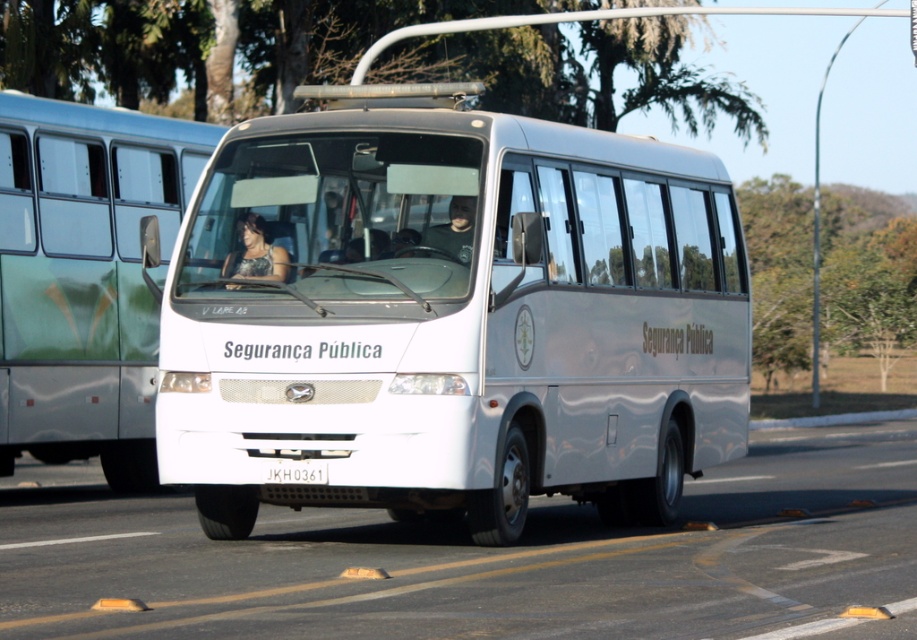
Question: Which object is positioned closest to the white metallic bus at center?

Choices:
 (A) white glossy bus at center
 (B) sparkly silver dress at center
 (C) matte black jacket at center

Answer: (C)

Question: Is white metallic bus at center thinner than white glossy bus at center?

Choices:
 (A) no
 (B) yes

Answer: (B)

Question: Among these points, which one is farthest from the camera?

Choices:
 (A) (94, 182)
 (B) (695, 232)
 (C) (302, 464)

Answer: (A)

Question: Which point is farther from the camera taking this photo?

Choices:
 (A) (305, 474)
 (B) (465, 209)

Answer: (B)

Question: In this image, where is white glossy bus at center located relative to sparkly silver dress at center?

Choices:
 (A) above
 (B) below

Answer: (A)

Question: Is white glossy bus at center to the left of matte black jacket at center from the viewer's perspective?

Choices:
 (A) yes
 (B) no

Answer: (A)